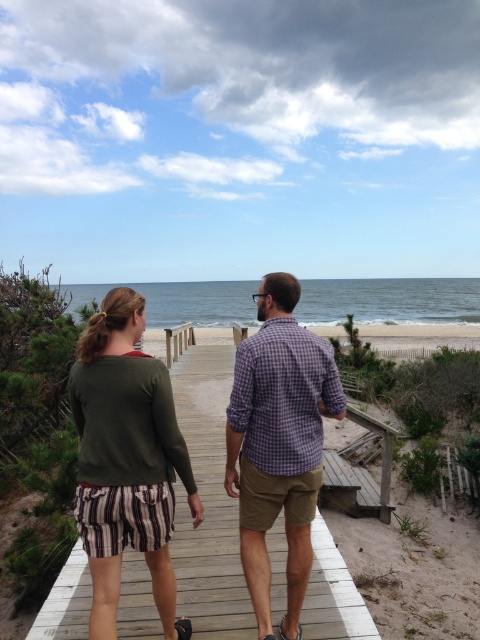
You are standing at the camera position and see two points on the boardwalk. Which point is closer to you, point (342, 602) or point (312, 385)?

Point (342, 602) is closer to you because it is further to the camera than point (312, 385).

You are planning to walk along the wooden boardwalk at center with a 1.5 meter wide cart. The green sweater at center is placed on the boardwalk. Can the cart pass through the boardwalk without touching the sides?

The wooden boardwalk at center is narrower than the green sweater at center. Since the cart is 1.5 meters wide, it cannot pass through the boardwalk as its width is less than the cart.